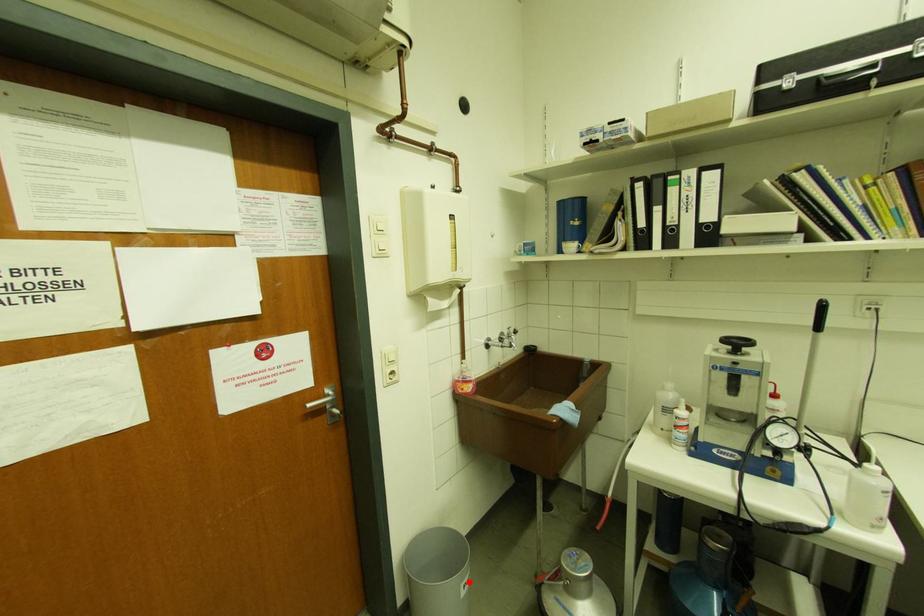
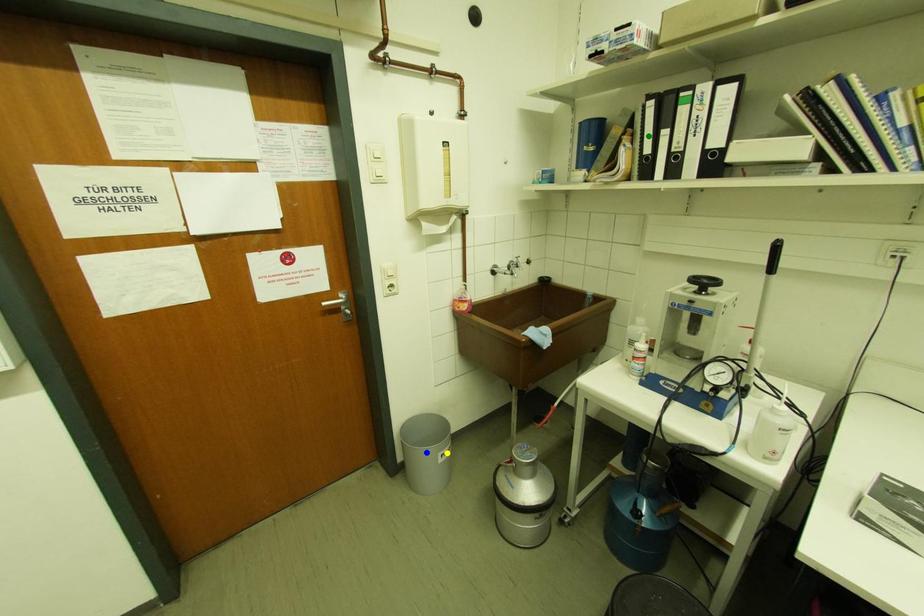
Question: I am providing you with two images of the same scene from different viewpoints. A red point is marked on the first image. You are given multiple points on the second image. In image 2, which mark is for the same physical point as the one in image 1?

Choices:
 (A) yellow point
 (B) blue point
 (C) green point

Answer: (A)